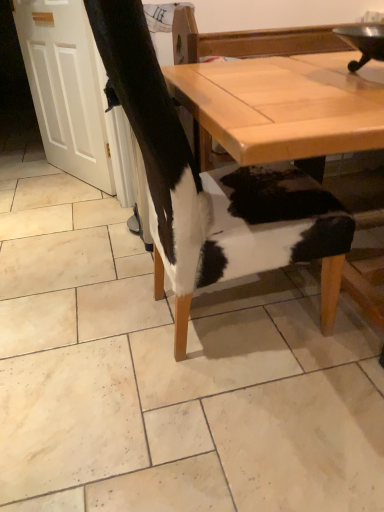
Question: Considering the relative sizes of cowhide chair at center and cowhide chair at center in the image provided, is cowhide chair at center taller than cowhide chair at center?

Choices:
 (A) no
 (B) yes

Answer: (A)

Question: From a real-world perspective, is cowhide chair at center on cowhide chair at center?

Choices:
 (A) no
 (B) yes

Answer: (A)

Question: Is cowhide chair at center wider than cowhide chair at center?

Choices:
 (A) no
 (B) yes

Answer: (B)

Question: From the image's perspective, is cowhide chair at center over cowhide chair at center?

Choices:
 (A) yes
 (B) no

Answer: (B)

Question: Is cowhide chair at center further to the viewer compared to cowhide chair at center?

Choices:
 (A) yes
 (B) no

Answer: (A)

Question: Based on their positions, is cowhide chair at center located to the left or right of cowhide chair at center?

Choices:
 (A) left
 (B) right

Answer: (A)

Question: Is cowhide chair at center wider or thinner than cowhide chair at center?

Choices:
 (A) thin
 (B) wide

Answer: (A)

Question: Based on their sizes in the image, would you say cowhide chair at center is bigger or smaller than cowhide chair at center?

Choices:
 (A) big
 (B) small

Answer: (B)

Question: From a real-world perspective, is cowhide chair at center positioned above or below cowhide chair at center?

Choices:
 (A) below
 (B) above

Answer: (B)

Question: Looking at the image, does light brown wooden table at center seem bigger or smaller compared to cowhide at center?

Choices:
 (A) small
 (B) big

Answer: (B)

Question: In the image, is light brown wooden table at center positioned in front of or behind cowhide at center?

Choices:
 (A) behind
 (B) front

Answer: (B)

Question: Considering the positions of point (246, 68) and point (122, 10), is point (246, 68) closer or farther from the camera than point (122, 10)?

Choices:
 (A) farther
 (B) closer

Answer: (A)

Question: From a real-world perspective, is light brown wooden table at center positioned above or below cowhide at center?

Choices:
 (A) below
 (B) above

Answer: (B)

Question: Is cowhide chair at center situated inside light brown wooden table at center or outside?

Choices:
 (A) inside
 (B) outside

Answer: (B)

Question: Looking at their shapes, would you say cowhide chair at center is wider or thinner than light brown wooden table at center?

Choices:
 (A) thin
 (B) wide

Answer: (B)